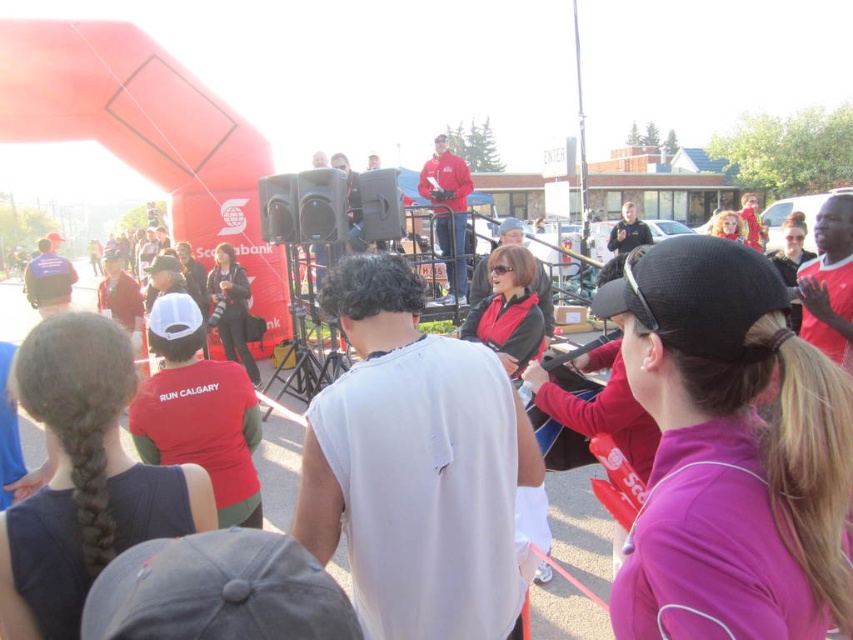
You are a photographer at the event and want to capture a photo that includes both the white matte shirt at center and the matte red jacket at upper center. Which of these two objects is positioned closer to you, the photographer?

The white matte shirt at center is closer to the photographer than the matte red jacket at upper center.